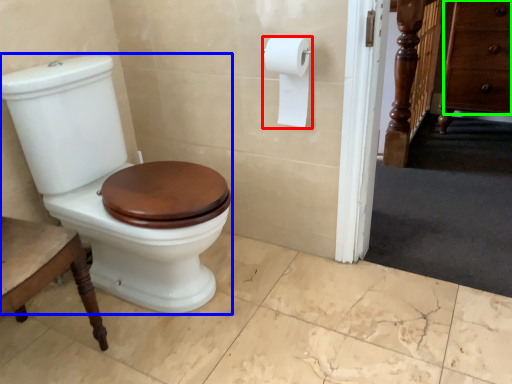
Question: Based on their relative distances, which object is nearer to toilet paper (highlighted by a red box)? Choose from porcelain (highlighted by a blue box) and drawer (highlighted by a green box).

Choices:
 (A) porcelain
 (B) drawer

Answer: (A)